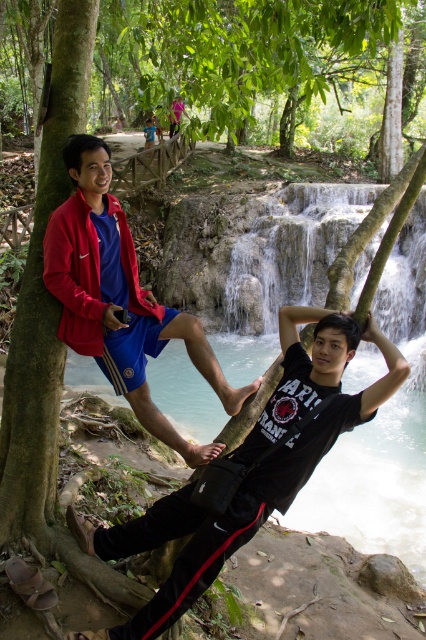
How far apart are black matte shirt at center and matte blue shorts at left?

30.85 inches

Does black matte shirt at center appear under matte blue shorts at left?

Correct, black matte shirt at center is located below matte blue shorts at left.

Which is in front, point (89, 637) or point (204, 458)?

Point (89, 637) is more forward.

You are a GUI agent. You are given a task and a screenshot of the screen. Output one action in this format:
    pyautogui.click(x=<x>, y=<y>)
    Task: Click on the black matte shirt at center
    This screenshot has width=426, height=640.
    Given the screenshot: What is the action you would take?
    coord(252,468)